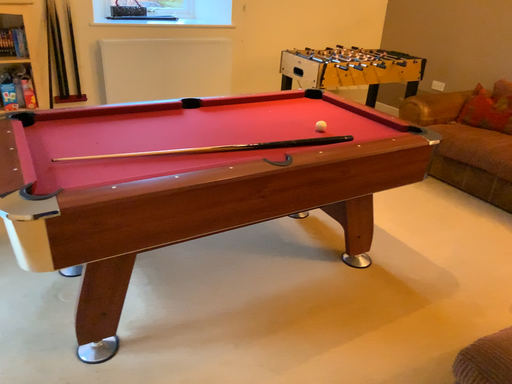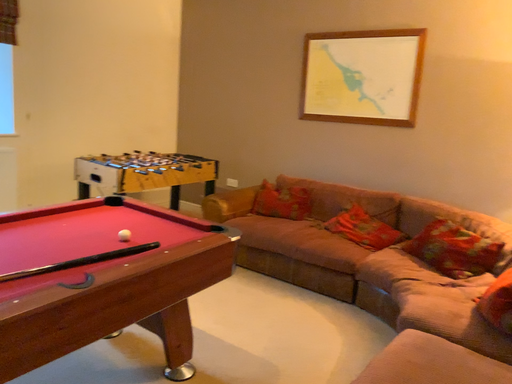
Question: Which way did the camera rotate in the video?

Choices:
 (A) rotated right
 (B) rotated left

Answer: (A)